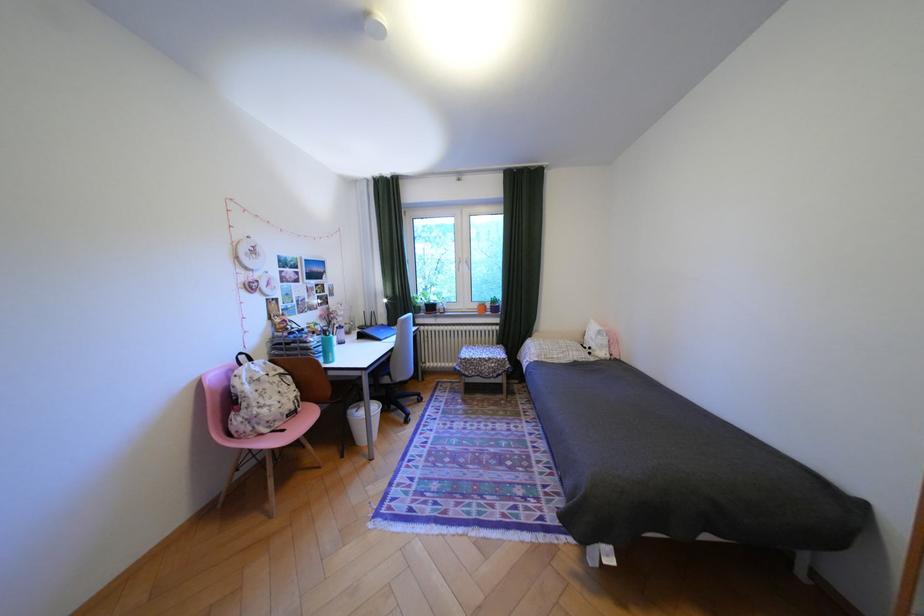
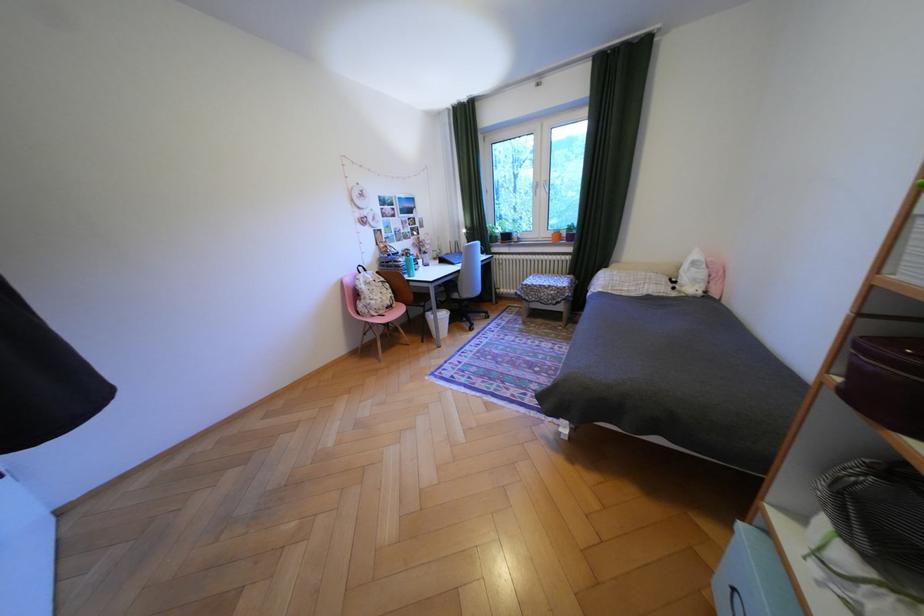
Locate, in the second image, the point that corresponds to [369,415] in the first image.

(442, 315)